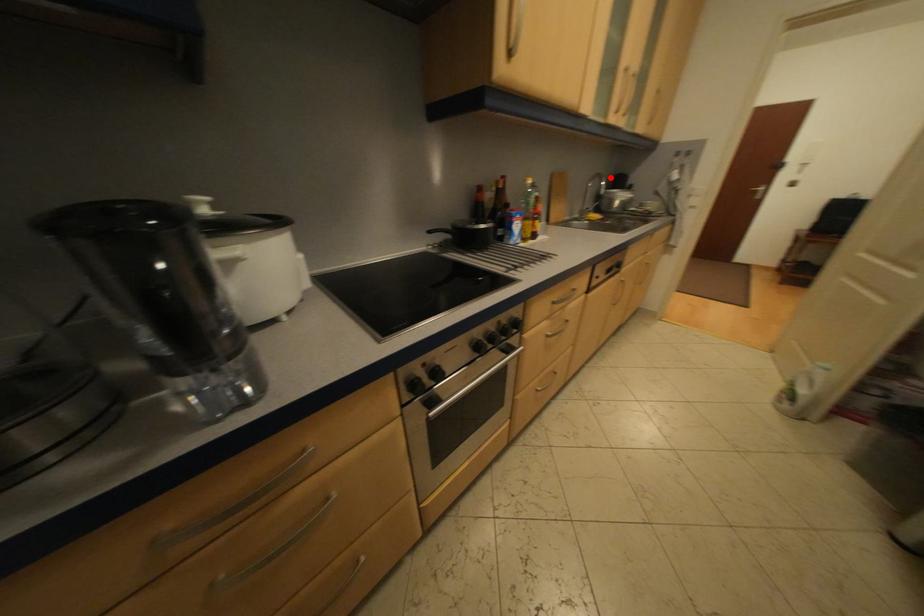
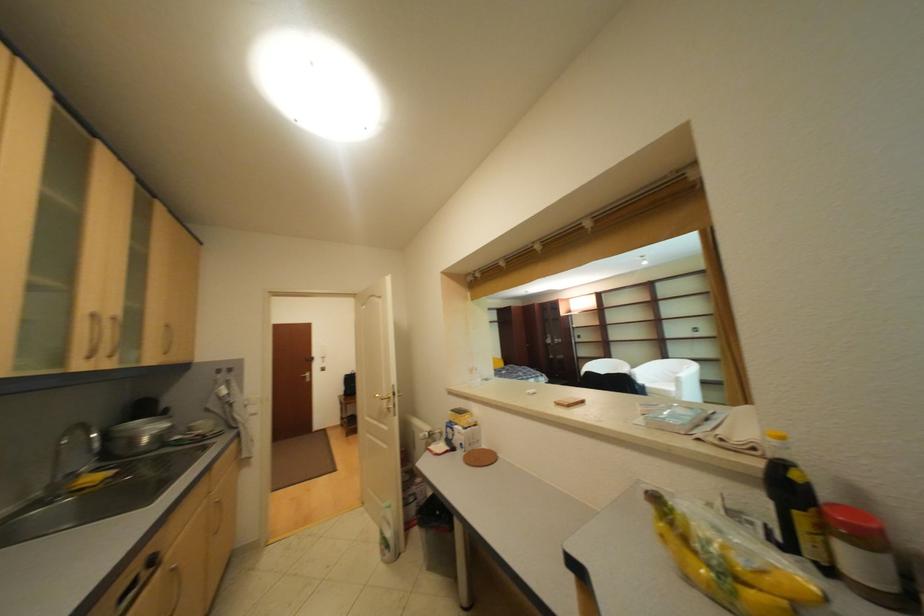
The point at the highlighted location is marked in the first image. Where is the corresponding point in the second image?

(94, 428)